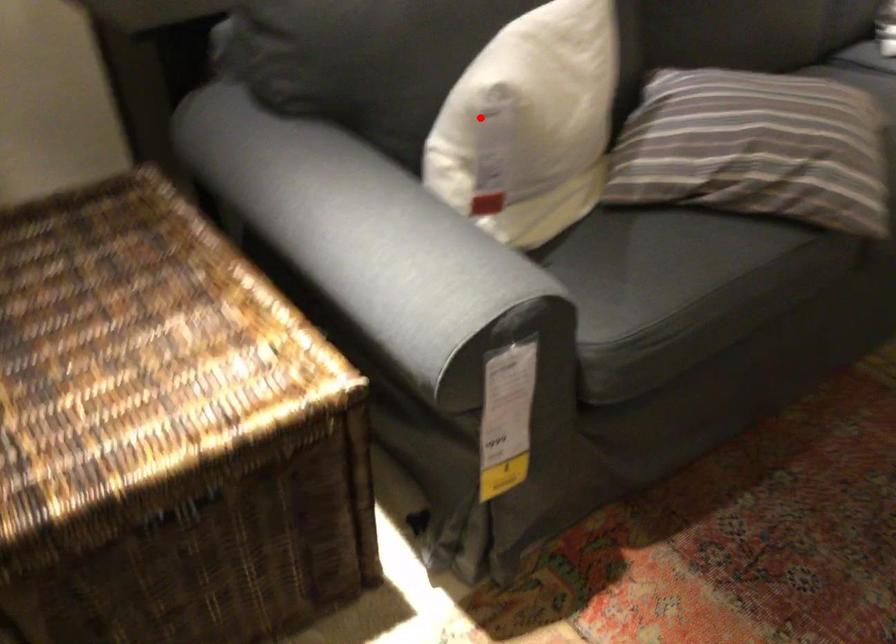
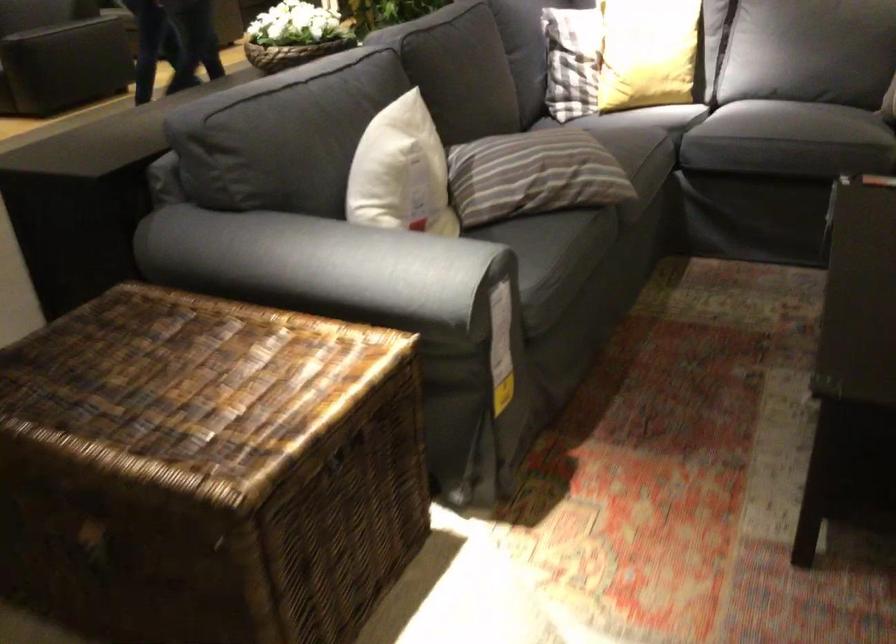
Where in the second image is the point corresponding to the highlighted location from the first image?

(401, 172)